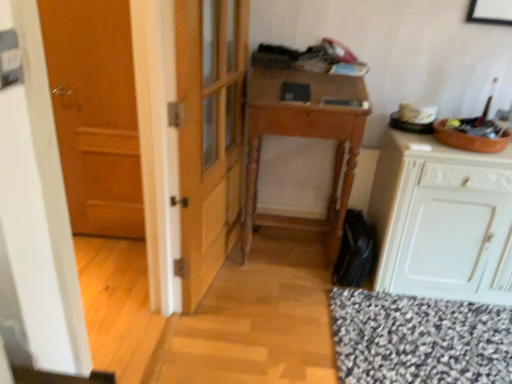
Question: Is white painted wood cabinet at right positioned far away from wooden desk at center?

Choices:
 (A) no
 (B) yes

Answer: (A)

Question: Is the depth of white painted wood cabinet at right greater than that of wooden desk at center?

Choices:
 (A) no
 (B) yes

Answer: (A)

Question: Can you confirm if white painted wood cabinet at right is taller than wooden desk at center?

Choices:
 (A) no
 (B) yes

Answer: (A)

Question: From the image's perspective, does white painted wood cabinet at right appear lower than wooden desk at center?

Choices:
 (A) no
 (B) yes

Answer: (B)

Question: Is white painted wood cabinet at right facing away from wooden desk at center?

Choices:
 (A) yes
 (B) no

Answer: (B)

Question: Is wooden desk at center in front of or behind wooden door at left in the image?

Choices:
 (A) behind
 (B) front

Answer: (B)

Question: Is wooden desk at center spatially inside wooden door at left, or outside of it?

Choices:
 (A) inside
 (B) outside

Answer: (B)

Question: From a real-world perspective, relative to wooden door at left, is wooden desk at center vertically above or below?

Choices:
 (A) above
 (B) below

Answer: (B)

Question: Based on their sizes in the image, would you say wooden desk at center is bigger or smaller than wooden door at left?

Choices:
 (A) small
 (B) big

Answer: (B)

Question: Would you say wooden desk at center is to the left or to the right of white painted wood cabinet at right in the picture?

Choices:
 (A) left
 (B) right

Answer: (A)

Question: Looking at the image, does wooden desk at center seem bigger or smaller compared to white painted wood cabinet at right?

Choices:
 (A) big
 (B) small

Answer: (B)

Question: From the image's perspective, is wooden desk at center above or below white painted wood cabinet at right?

Choices:
 (A) above
 (B) below

Answer: (A)

Question: Is wooden desk at center in front of or behind white painted wood cabinet at right in the image?

Choices:
 (A) front
 (B) behind

Answer: (B)

Question: From the image's perspective, relative to white painted wood cabinet at right, is wooden door at left above or below?

Choices:
 (A) below
 (B) above

Answer: (B)

Question: Looking at their shapes, would you say wooden door at left is wider or thinner than white painted wood cabinet at right?

Choices:
 (A) wide
 (B) thin

Answer: (B)